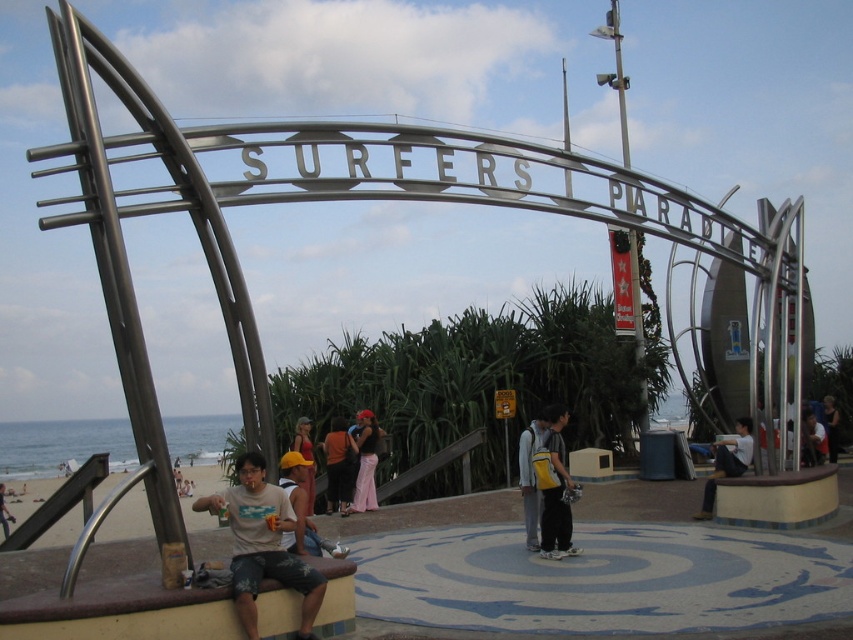
You are a photographer at the beach scene at Surfers Paradise. You need to position a model wearing the matte black dress at center so that she is visible from the archway. Where should you place her relative to the matte gray surfboard at lower left?

Place the model wearing the matte black dress at center to the right of the matte gray surfboard at lower left to ensure visibility from the archway.

You are planning to place the light brown wooden bench at center on top of the matte gray surfboard at lower left. Will the bench fit entirely on the surfboard?

The light brown wooden bench at center is narrower than the matte gray surfboard at lower left, so it will fit entirely on the surfboard.